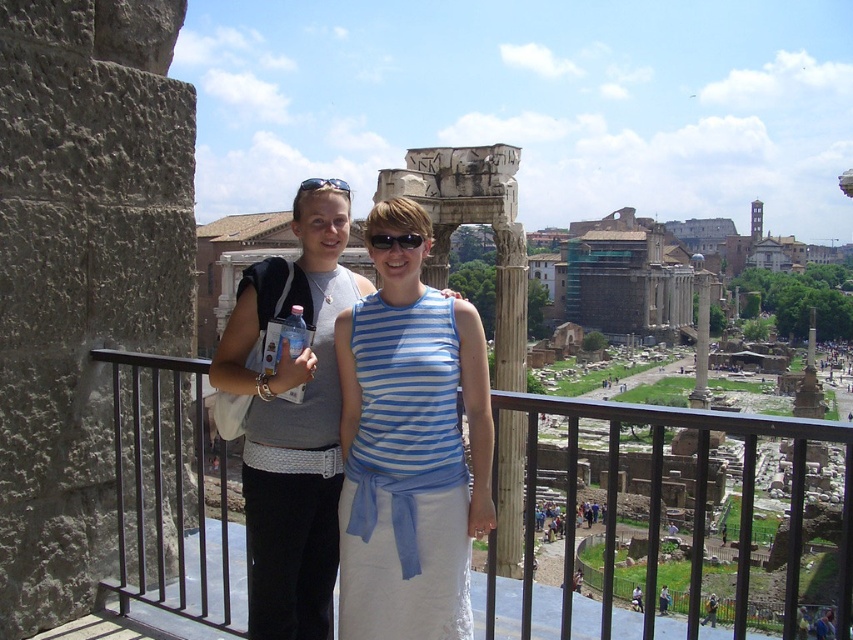
Question: Which of the following is the closest to the observer?

Choices:
 (A) (508, 568)
 (B) (300, 182)

Answer: (A)

Question: Does blue striped tank top at center appear on the right side of black plastic sunglasses at center?

Choices:
 (A) no
 (B) yes

Answer: (A)

Question: Based on their relative distances, which object is farther from the blue striped tank top at center?

Choices:
 (A) black metal railing at center
 (B) matte gray tank top at center
 (C) black plastic sunglasses at center
 (D) wooden column at center

Answer: (A)

Question: Is matte gray tank top at center thinner than wooden column at center?

Choices:
 (A) yes
 (B) no

Answer: (B)

Question: Is black metal railing at center positioned at the back of black plastic sunglasses at center?

Choices:
 (A) no
 (B) yes

Answer: (A)

Question: Which of the following is the closest to the observer?

Choices:
 (A) (521, 506)
 (B) (380, 236)
 (C) (340, 189)

Answer: (B)